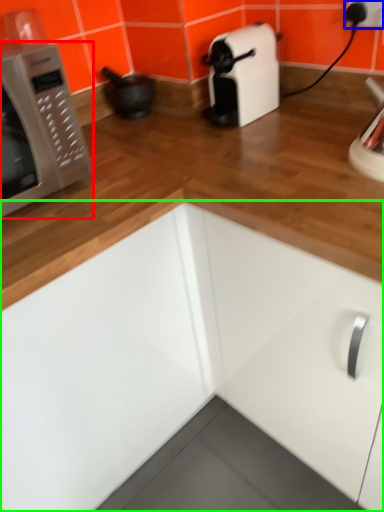
Question: Which object is the farthest from microwave oven (highlighted by a red box)? Choose among these: electric outlet (highlighted by a blue box) or cabinetry (highlighted by a green box).

Choices:
 (A) electric outlet
 (B) cabinetry

Answer: (A)